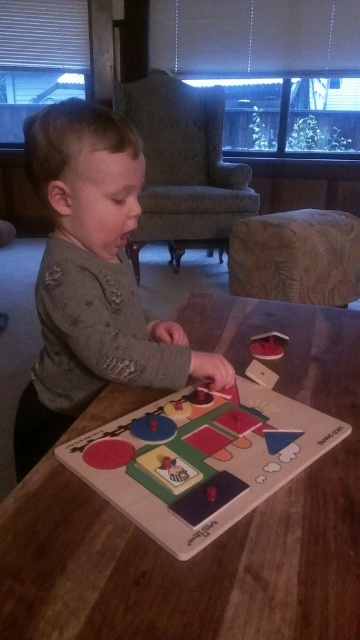
The height and width of the screenshot is (640, 360). What do you see at coordinates (92, 278) in the screenshot?
I see `gray fabric toddler at center` at bounding box center [92, 278].

Is point (92, 198) farther from camera compared to point (276, 337)?

That is False.

Where is `gray fabric toddler at center`? gray fabric toddler at center is located at coordinates (92, 278).

How far apart are gray fabric toddler at center and wooden puzzle at center?

gray fabric toddler at center is 6.82 inches from wooden puzzle at center.

Which is above, gray fabric toddler at center or wooden puzzle at center?

gray fabric toddler at center is higher up.

Is point (105, 376) farther from viewer compared to point (254, 401)?

That is False.

You are a GUI agent. You are given a task and a screenshot of the screen. Output one action in this format:
    pyautogui.click(x=<x>, y=<y>)
    Task: Click on the gray fabric toddler at center
    
    Given the screenshot: What is the action you would take?
    pyautogui.click(x=92, y=278)

Does wooden puzzle at center have a larger size compared to matte plastic toy at center?

Correct, wooden puzzle at center is larger in size than matte plastic toy at center.

Between wooden puzzle at center and matte plastic toy at center, which one has more height?

Standing taller between the two is wooden puzzle at center.

At what (x,y) coordinates should I click in order to perform the action: click on wooden puzzle at center. Please return your answer as a coordinate pair (x, y). The height and width of the screenshot is (640, 360). Looking at the image, I should click on (200, 460).